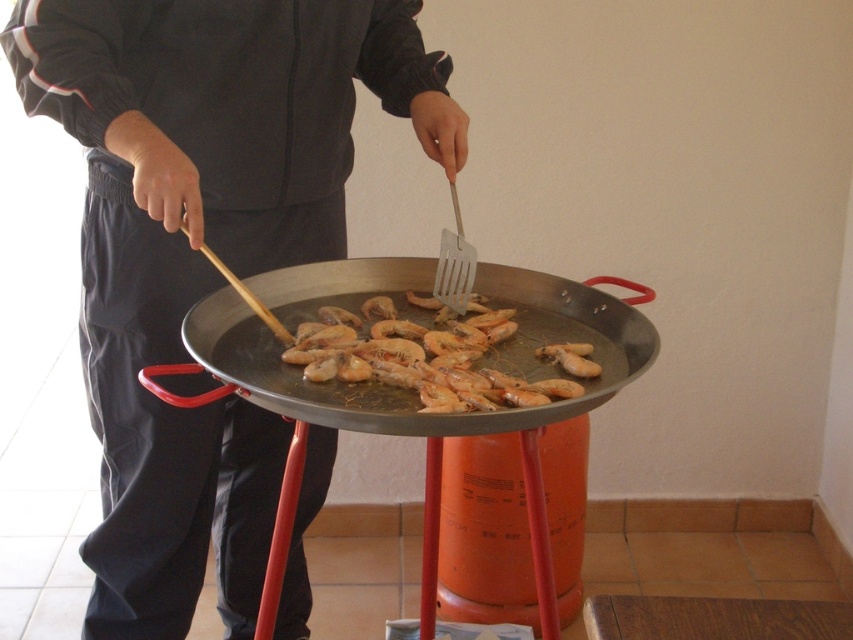
You are a chef trying to flip the shiny golden shrimp at center using a spatula. The spatula can reach up to 8 centimeters. Can you reach the shrimp with the spatula from the shiny metal wok at center?

The shiny metal wok at center and shiny golden shrimp at center are 7.90 centimeters apart. Since the spatula can reach up to 8 centimeters, you can reach the shrimp with the spatula from the shiny metal wok at center.